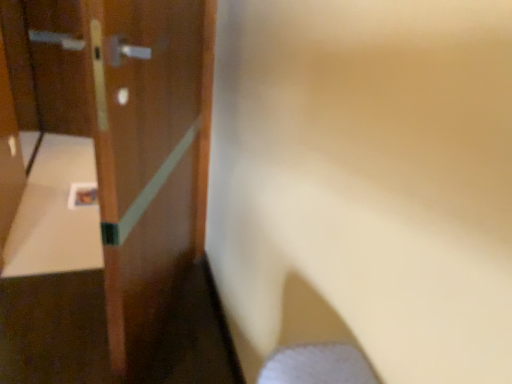
Identify the location of wooden door at left. The height and width of the screenshot is (384, 512). (104, 189).

The width and height of the screenshot is (512, 384). What do you see at coordinates (104, 189) in the screenshot?
I see `wooden door at left` at bounding box center [104, 189].

At what (x,y) coordinates should I click in order to perform the action: click on wooden door at left. Please return your answer as a coordinate pair (x, y). Looking at the image, I should click on [x=104, y=189].